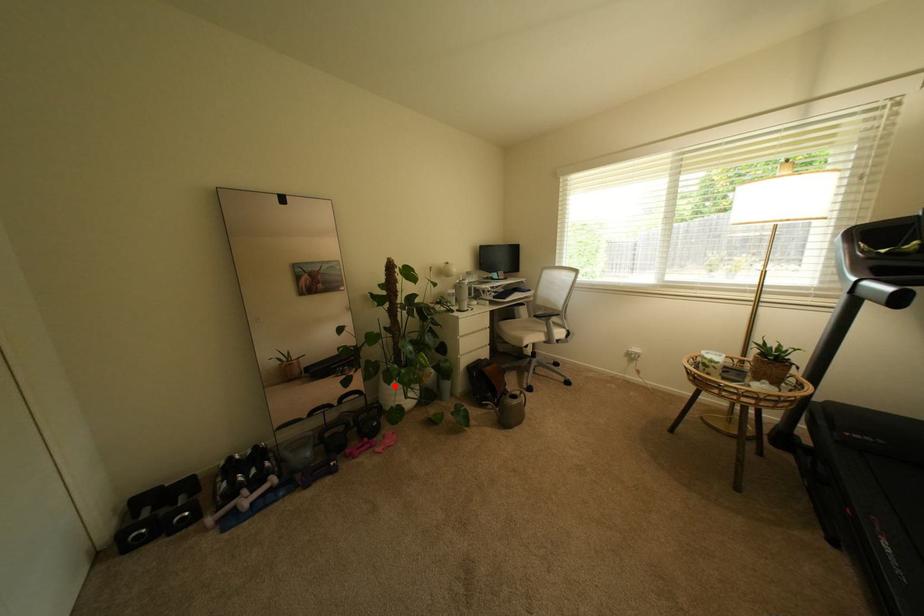
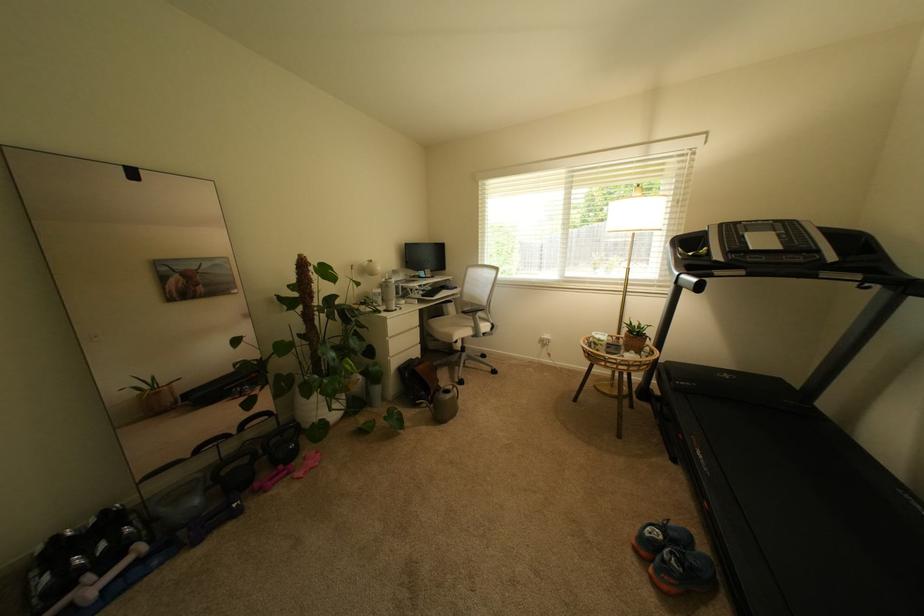
Find the pixel in the second image that matches the highlighted location in the first image.

(312, 400)